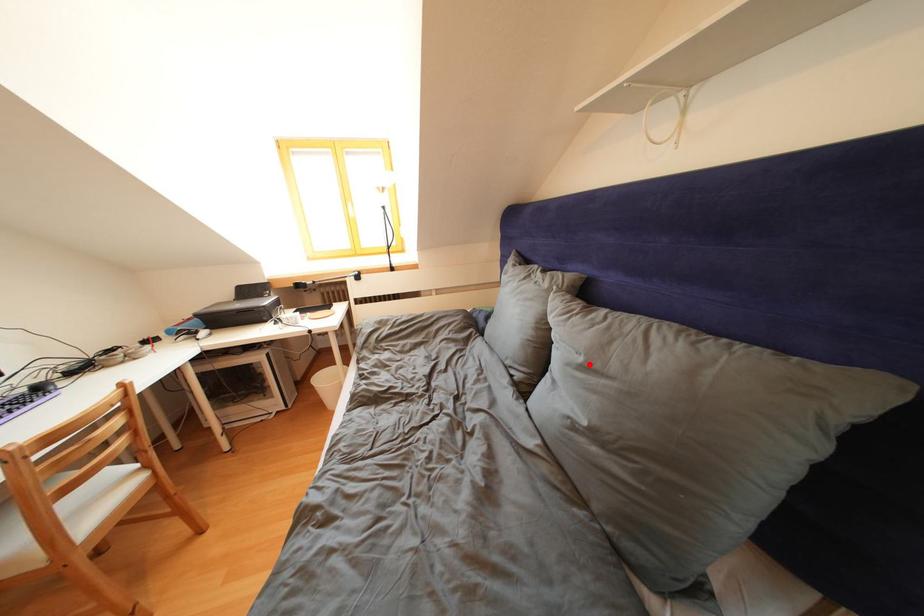
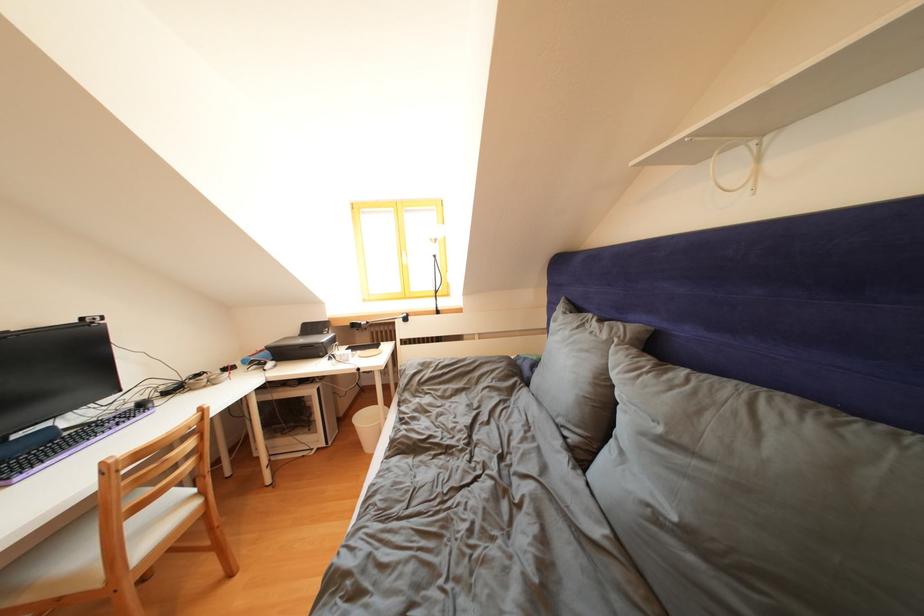
Where in the second image is the point corresponding to the highlighted location from the first image?

(667, 435)